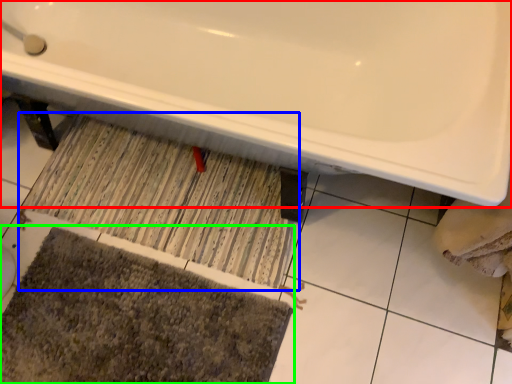
Question: Which is nearer to the bathtub (highlighted by a red box)? doormat (highlighted by a blue box) or bath mat (highlighted by a green box).

Choices:
 (A) doormat
 (B) bath mat

Answer: (A)